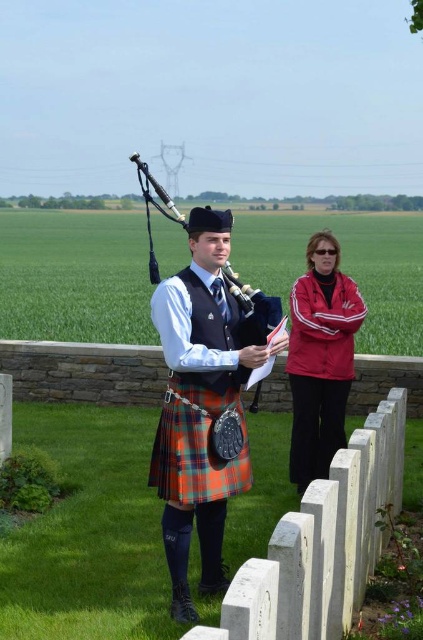
Question: Observing the image, what is the correct spatial positioning of red fabric jacket at center in reference to plaid wool kilt at center?

Choices:
 (A) above
 (B) below

Answer: (A)

Question: In this image, where is orange plaid kilt at center located relative to polished wood bagpipe at center?

Choices:
 (A) right
 (B) left

Answer: (A)

Question: Which object is closer to the camera taking this photo?

Choices:
 (A) polished wood bagpipe at center
 (B) orange plaid kilt at center
 (C) red fabric jacket at center
 (D) plaid wool kilt at center

Answer: (B)

Question: Estimate the real-world distances between objects in this image. Which object is closer to the plaid wool kilt at center?

Choices:
 (A) polished wood bagpipe at center
 (B) red fabric jacket at center

Answer: (A)

Question: Considering the real-world distances, which object is closest to the red fabric jacket at center?

Choices:
 (A) polished wood bagpipe at center
 (B) orange plaid kilt at center
 (C) plaid wool kilt at center

Answer: (A)

Question: Is plaid wool kilt at center to the left of polished wood bagpipe at center from the viewer's perspective?

Choices:
 (A) yes
 (B) no

Answer: (B)